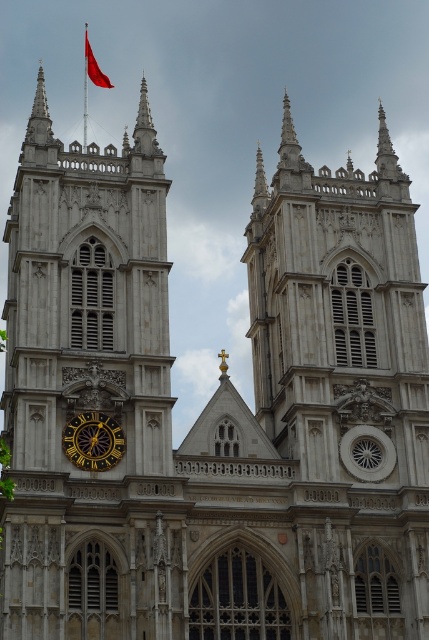
Is point (23, 381) less distant than point (84, 52)?

Yes.

Which of these two, stone clock tower at left or smooth red flag at upper left, stands shorter?

smooth red flag at upper left

The width and height of the screenshot is (429, 640). Identify the location of stone clock tower at left. (87, 300).

What are the coordinates of `stone clock tower at left` in the screenshot? It's located at (87, 300).

Does gold metallic clock at lower left appear under smooth red flag at upper left?

Indeed, gold metallic clock at lower left is positioned under smooth red flag at upper left.

Does point (76, 422) come in front of point (93, 65)?

Yes, it is in front of point (93, 65).

What do you see at coordinates (93, 440) in the screenshot? Image resolution: width=429 pixels, height=640 pixels. I see `gold metallic clock at lower left` at bounding box center [93, 440].

Find the location of a particular element. The image size is (429, 640). gold metallic clock at lower left is located at coordinates (93, 440).

Is point (12, 241) in front of point (96, 448)?

No, it is not.

Is stone clock tower at left bigger than gold metallic clock at lower left?

Yes.

Identify the location of stone clock tower at left. This screenshot has width=429, height=640. (87, 300).

This screenshot has width=429, height=640. I want to click on stone clock tower at left, so click(87, 300).